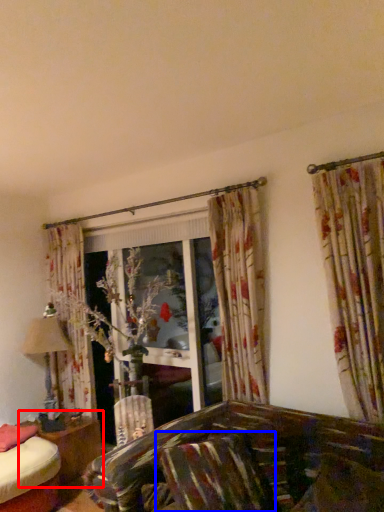
Question: Which object appears closest to the camera in this image, table (highlighted by a red box) or pillow (highlighted by a blue box)?

Choices:
 (A) table
 (B) pillow

Answer: (B)